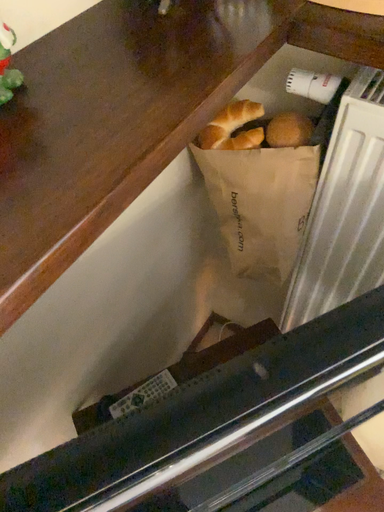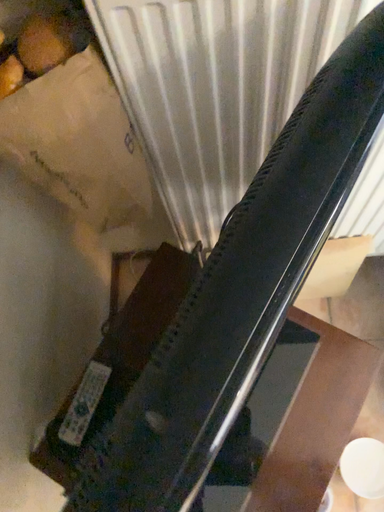
Question: Which way did the camera rotate in the video?

Choices:
 (A) rotated upward
 (B) rotated downward

Answer: (B)